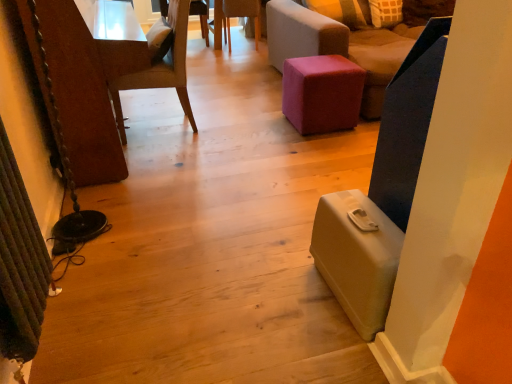
I want to click on free space in front of matte green suitcase at lower right, so click(x=322, y=351).